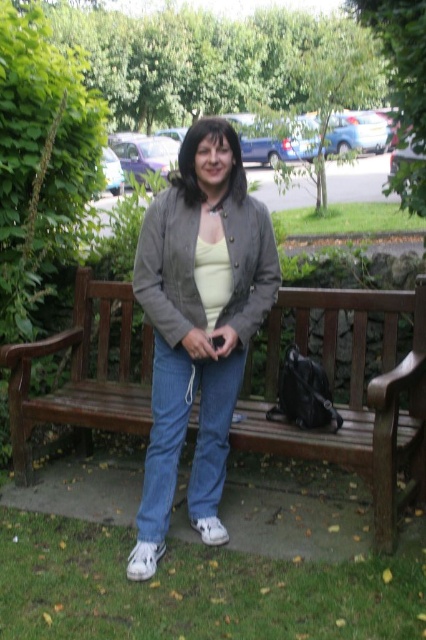
Can you confirm if matte gray jacket at center is positioned to the right of brown wooden bench at center?

Incorrect, matte gray jacket at center is not on the right side of brown wooden bench at center.

Does matte gray jacket at center have a larger size compared to brown wooden bench at center?

Incorrect, matte gray jacket at center is not larger than brown wooden bench at center.

Between point (219, 353) and point (137, 404), which one is positioned behind?

Positioned behind is point (137, 404).

Where is `matte gray jacket at center`? The width and height of the screenshot is (426, 640). matte gray jacket at center is located at coordinates (198, 324).